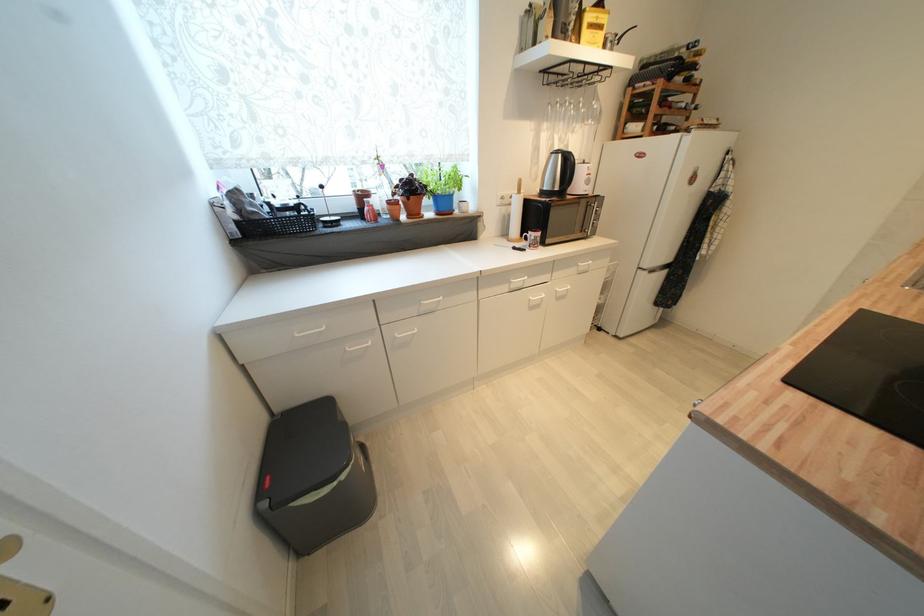
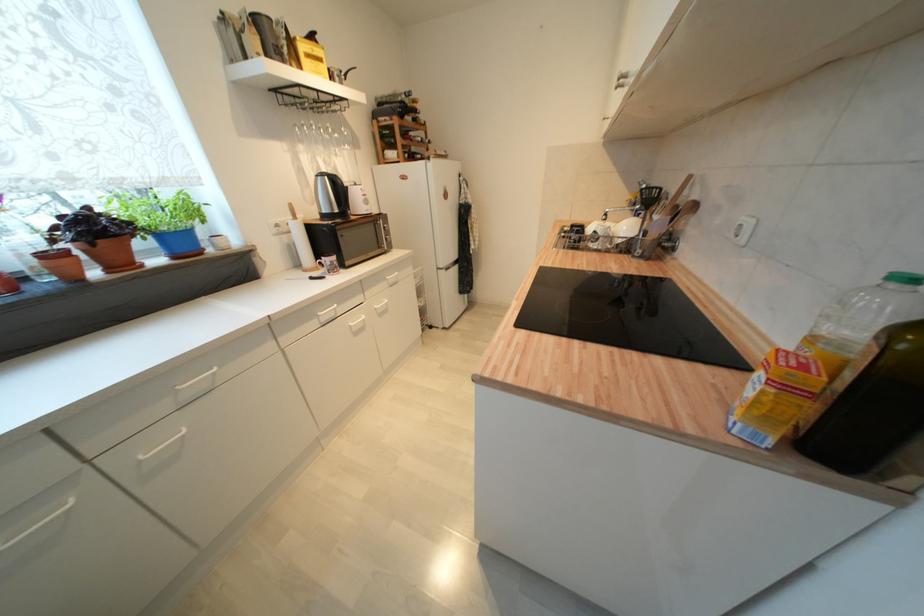
Question: The camera is either moving clockwise (left) or counter-clockwise (right) around the object. The first image is from the beginning of the video and the second image is from the end. Is the camera moving left or right when shooting the video?

Choices:
 (A) Left
 (B) Right

Answer: (A)